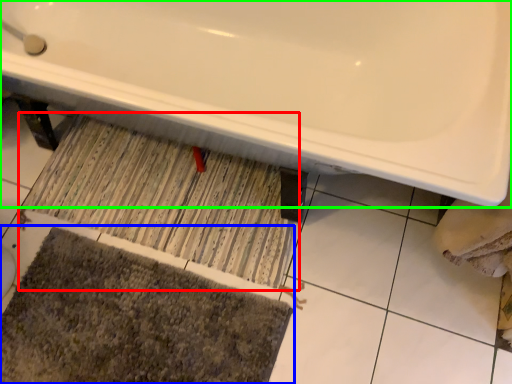
Question: Based on their relative distances, which object is nearer to doormat (highlighted by a red box)? Choose from bath mat (highlighted by a blue box) and bathtub (highlighted by a green box).

Choices:
 (A) bath mat
 (B) bathtub

Answer: (A)